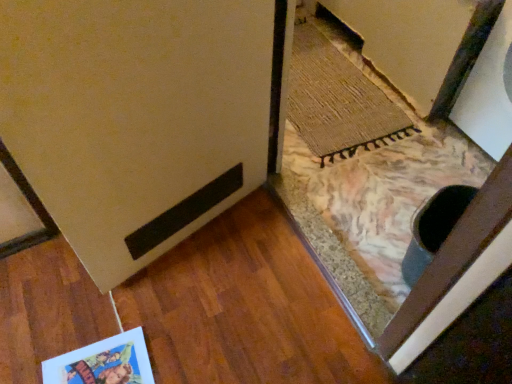
Question: Is matte cardboard postcard at lower left positioned with its back to matte beige door at lower left?

Choices:
 (A) no
 (B) yes

Answer: (A)

Question: From a real-world perspective, is matte cardboard postcard at lower left positioned over matte beige door at lower left based on gravity?

Choices:
 (A) no
 (B) yes

Answer: (A)

Question: Does matte cardboard postcard at lower left lie behind matte beige door at lower left?

Choices:
 (A) no
 (B) yes

Answer: (B)

Question: Is matte cardboard postcard at lower left at the right side of matte beige door at lower left?

Choices:
 (A) no
 (B) yes

Answer: (A)

Question: Is matte cardboard postcard at lower left placed right next to matte beige door at lower left?

Choices:
 (A) no
 (B) yes

Answer: (A)

Question: In terms of width, does matte beige door at lower left look wider or thinner when compared to rug at lower right?

Choices:
 (A) wide
 (B) thin

Answer: (B)

Question: Visually, is matte beige door at lower left positioned to the left or to the right of rug at lower right?

Choices:
 (A) right
 (B) left

Answer: (B)

Question: From a real-world perspective, relative to rug at lower right, is matte beige door at lower left vertically above or below?

Choices:
 (A) above
 (B) below

Answer: (A)

Question: From the image's perspective, is matte beige door at lower left positioned above or below rug at lower right?

Choices:
 (A) below
 (B) above

Answer: (A)

Question: Which is correct: matte beige door at lower left is inside matte cardboard postcard at lower left, or outside of it?

Choices:
 (A) inside
 (B) outside

Answer: (B)

Question: Considering the relative positions of matte beige door at lower left and matte cardboard postcard at lower left in the image provided, is matte beige door at lower left to the left or to the right of matte cardboard postcard at lower left?

Choices:
 (A) left
 (B) right

Answer: (B)

Question: Is point (179, 77) positioned closer to the camera than point (93, 365)?

Choices:
 (A) farther
 (B) closer

Answer: (B)

Question: Looking at their shapes, would you say matte beige door at lower left is wider or thinner than matte cardboard postcard at lower left?

Choices:
 (A) thin
 (B) wide

Answer: (A)

Question: From a real-world perspective, is rug at lower right positioned above or below matte cardboard postcard at lower left?

Choices:
 (A) above
 (B) below

Answer: (B)

Question: Is rug at lower right wider or thinner than matte cardboard postcard at lower left?

Choices:
 (A) wide
 (B) thin

Answer: (A)